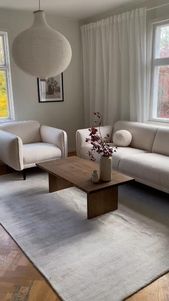
At what (x,y) coordinates should I click in order to perform the action: click on small canister. Please return your answer as a coordinate pair (x, y). Image resolution: width=169 pixels, height=301 pixels. Looking at the image, I should click on (95, 176).